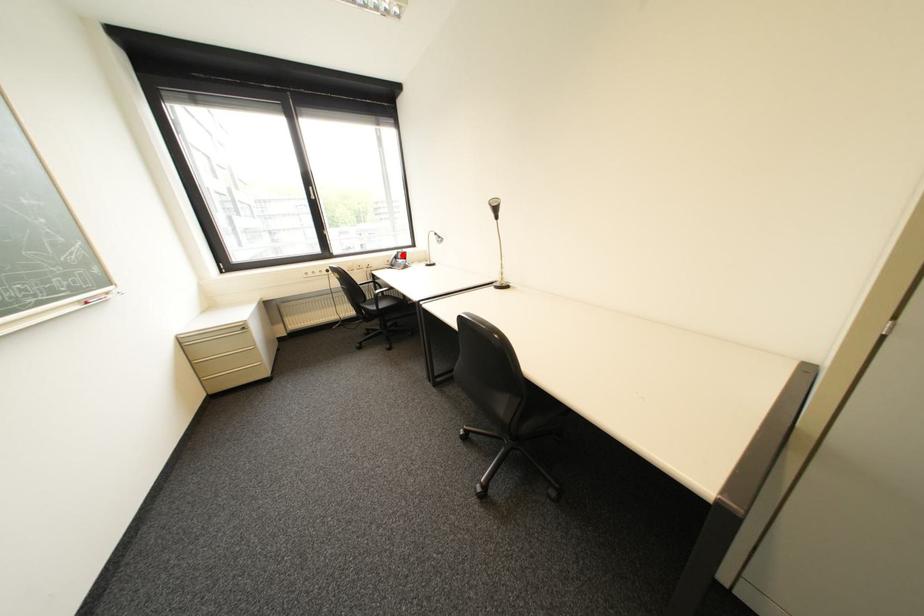
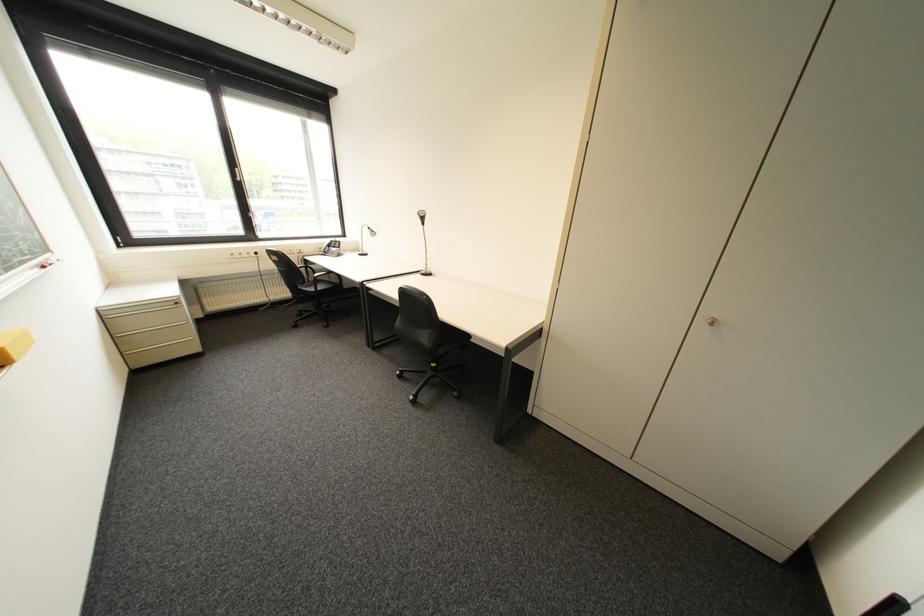
Find the pixel in the second image that matches the highlighted location in the first image.

(335, 244)